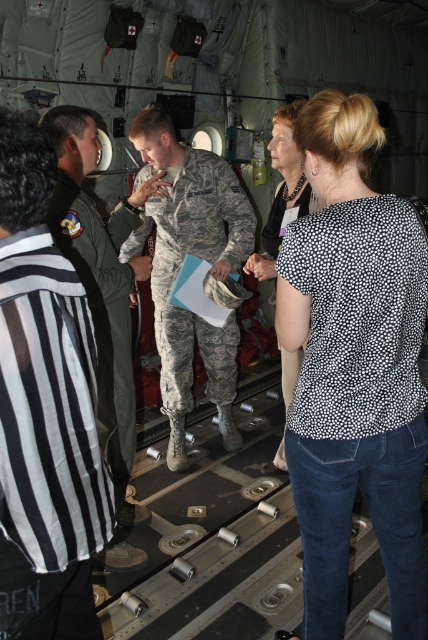
You are a passenger on this military transport aircraft and need to locate the emergency exit. You see a black striped shirt at left and a polka dot blouse at center. Which person is closer to you if you are facing the direction of the emergency exit?

The black striped shirt at left is closer to the viewer than the polka dot blouse at center, so the person wearing the black striped shirt at left is closer to you.